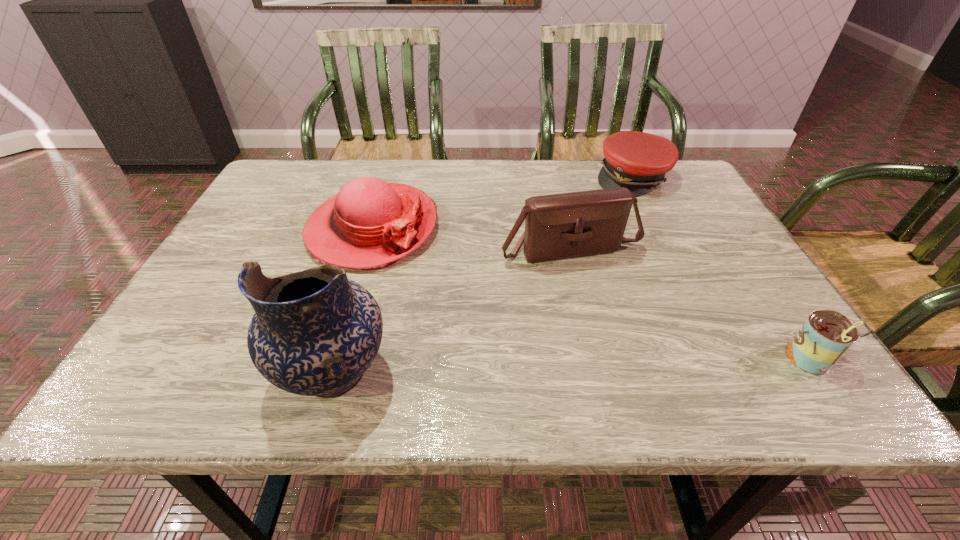
Image resolution: width=960 pixels, height=540 pixels. What are the coordinates of `the tallest object` in the screenshot? It's located at (315, 332).

Where is `can`? can is located at coordinates (826, 335).

The height and width of the screenshot is (540, 960). I want to click on hat, so click(x=370, y=223).

What are the coordinates of `the fourth shortest object` in the screenshot? It's located at (568, 225).

Identify the location of the shortest object. (638, 161).

The width and height of the screenshot is (960, 540). Identify the location of blank area located on the back of the tallest object. (354, 303).

I want to click on free spot located 0.240m on the left of the can, so click(x=648, y=359).

In order to click on free region located at the front of the hat with a bow in this screenshot , I will do `click(454, 316)`.

Where is `vacant space positioned 0.140m at the front of the hat with a bow`? This screenshot has height=540, width=960. vacant space positioned 0.140m at the front of the hat with a bow is located at coordinates (438, 299).

What are the coordinates of `free spot located at the front of the hat with a bow` in the screenshot? It's located at (466, 328).